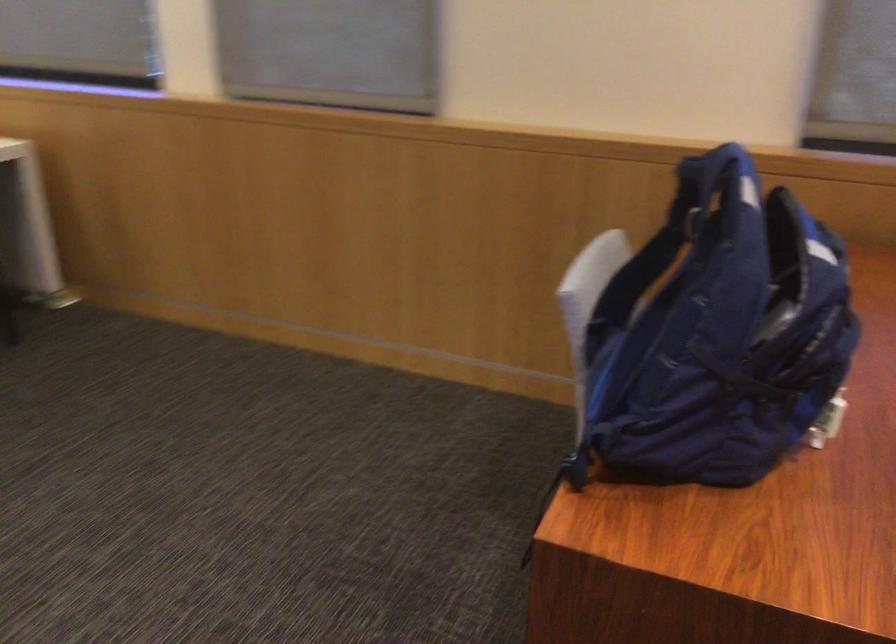
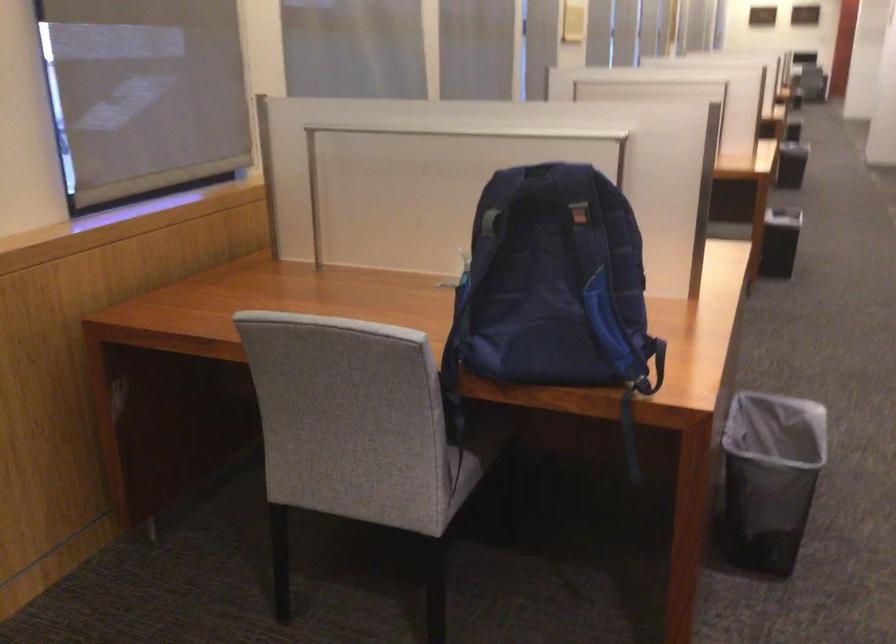
The point at (691, 178) is marked in the first image. Where is the corresponding point in the second image?

(538, 184)